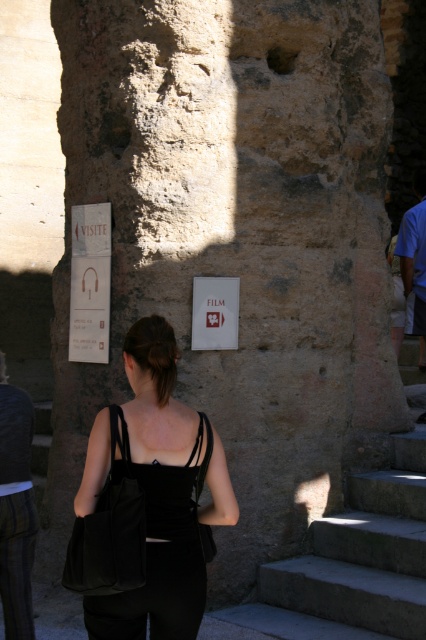
You are a tourist holding a black fabric bag at center and want to climb up the gray concrete stairs at lower right. Can you easily carry the bag while climbing the stairs?

The black fabric bag at center has a smaller size compared to gray concrete stairs at lower right, so it should be easy to carry the bag while climbing the stairs since it is not too large.